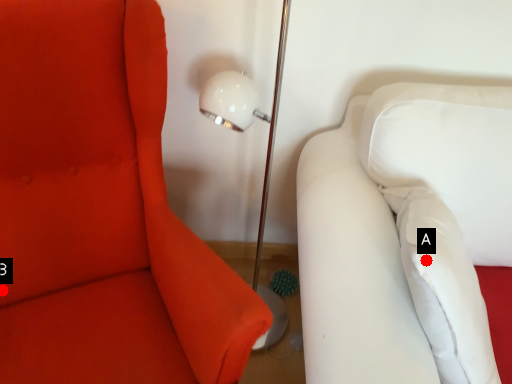
Question: Two points are circled on the image, labeled by A and B beside each circle. Which point appears farthest from the camera in this image?

Choices:
 (A) A is further
 (B) B is further

Answer: (B)